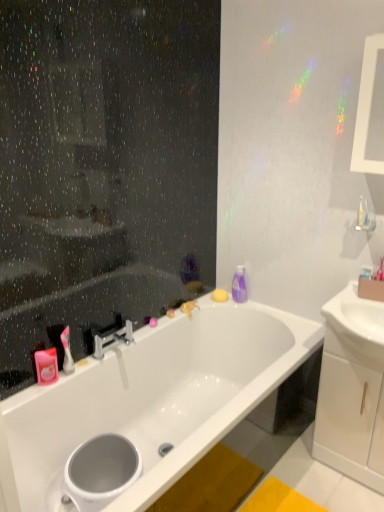
Locate an element on the screen. The image size is (384, 512). free spot to the left of purple glossy bottle at upper right, which appears as the first toiletry when viewed from the top is located at coordinates (222, 302).